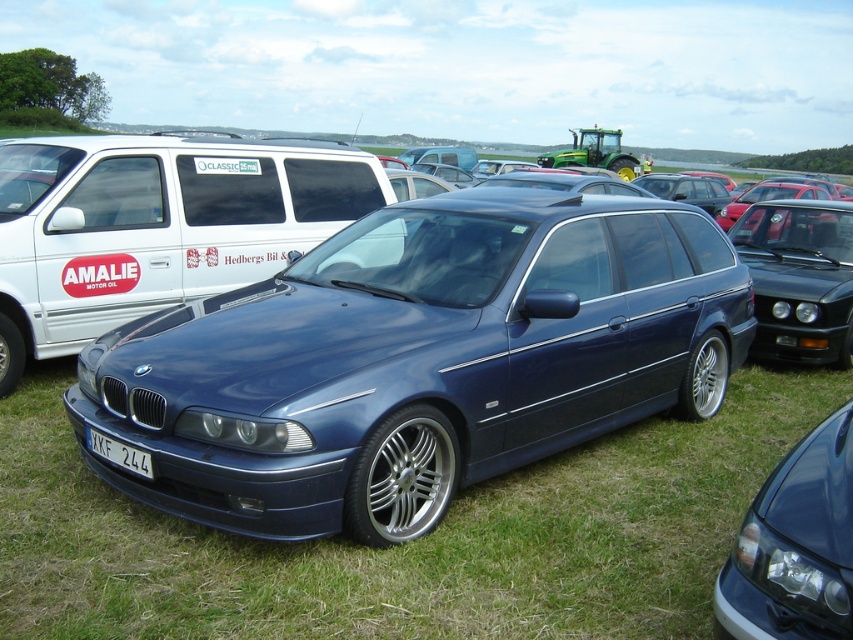
Question: Is metallic blue minivan at center smaller than satin black sedan at right?

Choices:
 (A) no
 (B) yes

Answer: (A)

Question: Does satin black car at center have a smaller size compared to white plastic license plate at lower center?

Choices:
 (A) no
 (B) yes

Answer: (A)

Question: Which of these objects is positioned closest to the white plastic license plate at lower center?

Choices:
 (A) satin black sedan at right
 (B) white matte van at center

Answer: (B)

Question: Estimate the real-world distances between objects in this image. Which object is closer to the satin black sedan at right?

Choices:
 (A) blue metallic car at center
 (B) white plastic license plate at lower center
 (C) satin black car at center
 (D) metallic blue minivan at center

Answer: (D)

Question: Can you confirm if white matte van at center is positioned above satin black car at center?

Choices:
 (A) no
 (B) yes

Answer: (B)

Question: Which point appears closest to the camera in this image?

Choices:
 (A) (x=132, y=460)
 (B) (x=128, y=252)

Answer: (A)